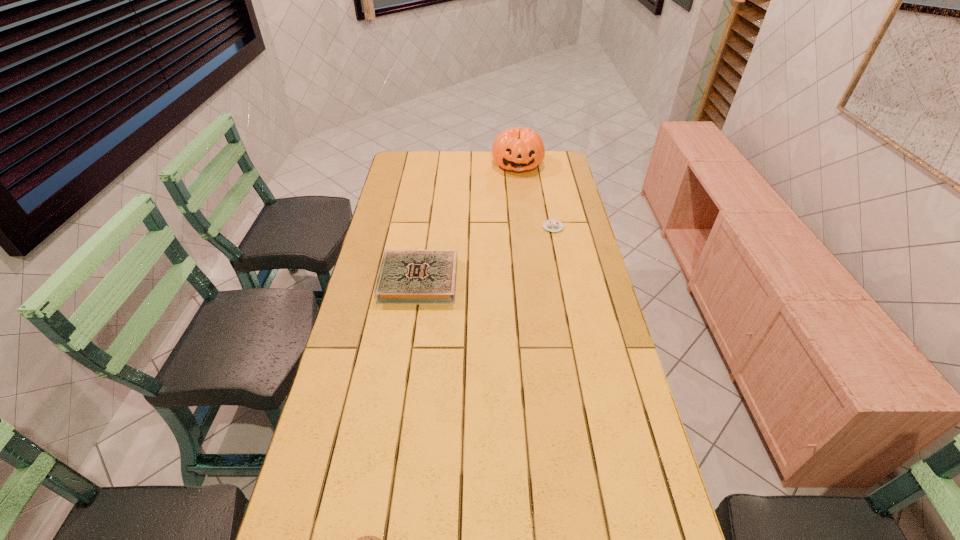
Find the location of `pumpkin`. pumpkin is located at coordinates (517, 149).

The width and height of the screenshot is (960, 540). In order to click on the farthest object in this screenshot , I will do `click(517, 149)`.

This screenshot has width=960, height=540. What are the coordinates of `the third shortest object` in the screenshot? It's located at (406, 276).

The image size is (960, 540). I want to click on the third farthest object, so coord(406,276).

Where is `the third nearest object`? The width and height of the screenshot is (960, 540). the third nearest object is located at coordinates point(551,225).

Identify the location of free point located on the carved face of the farthest object. (524, 214).

Locate an element on the screen. Image resolution: width=960 pixels, height=540 pixels. free spot located on the right of the third shortest object is located at coordinates (501, 281).

The height and width of the screenshot is (540, 960). Find the location of `free spot located 0.350m on the left of the third nearest object`. free spot located 0.350m on the left of the third nearest object is located at coordinates (452, 227).

The height and width of the screenshot is (540, 960). I want to click on object present at the far edge, so click(517, 149).

Identify the location of object that is at the left edge. (406, 276).